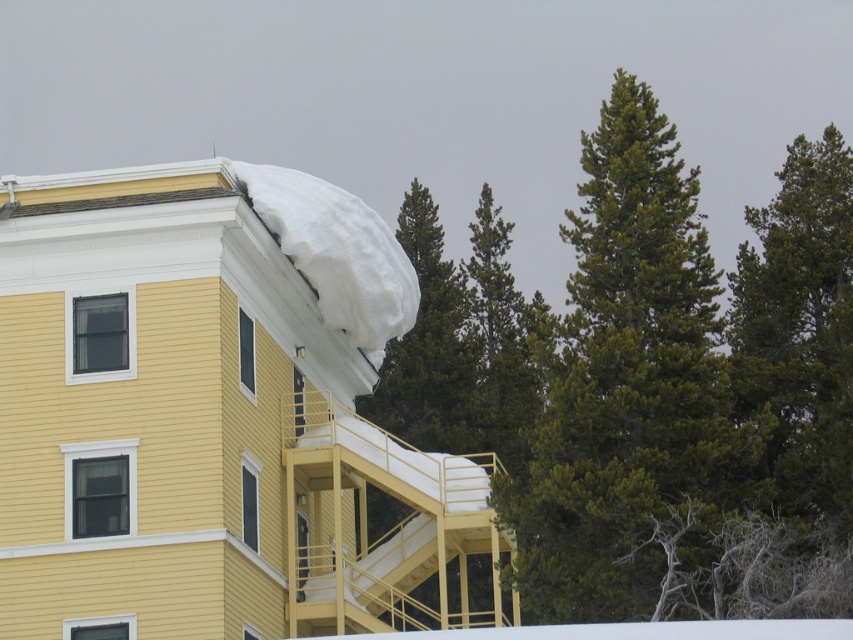
Is point (701, 536) less distant than point (316, 291)?

Yes, point (701, 536) is in front of point (316, 291).

Which of these two, green needle-like tree at upper right or white fluffy snow at upper right, stands taller?

Standing taller between the two is green needle-like tree at upper right.

The height and width of the screenshot is (640, 853). Describe the element at coordinates (630, 387) in the screenshot. I see `green needle-like tree at upper right` at that location.

Find the location of `green needle-like tree at upper right`. green needle-like tree at upper right is located at coordinates (630, 387).